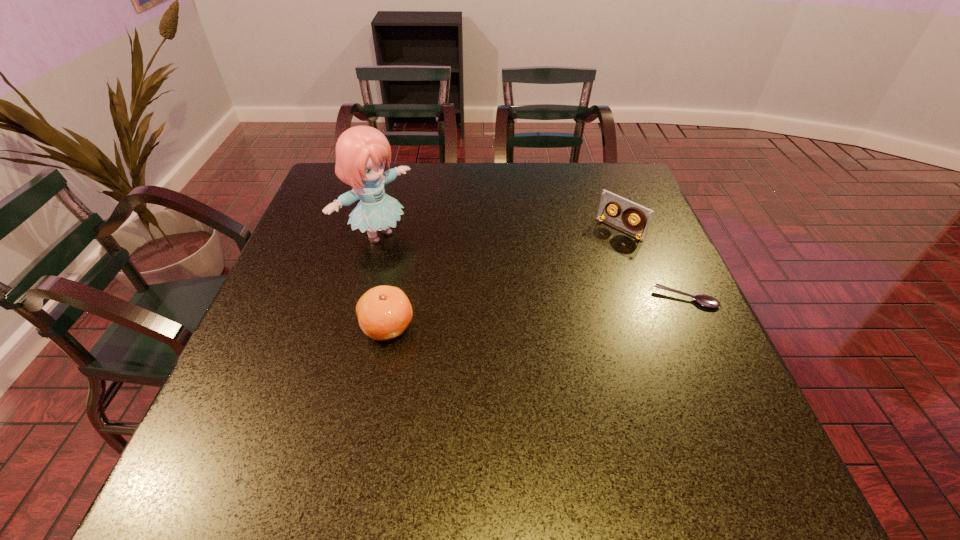
The height and width of the screenshot is (540, 960). Find the location of `free space on the desktop that is between the clementine and the soupspoon and is positioned on the front-facing side of the tallest object`. free space on the desktop that is between the clementine and the soupspoon and is positioned on the front-facing side of the tallest object is located at coordinates (514, 315).

Where is `vacant spot on the desktop that is between the clementine and the shortest object and is positioned at the front of the videotape with visible reels`? The width and height of the screenshot is (960, 540). vacant spot on the desktop that is between the clementine and the shortest object and is positioned at the front of the videotape with visible reels is located at coordinates (520, 314).